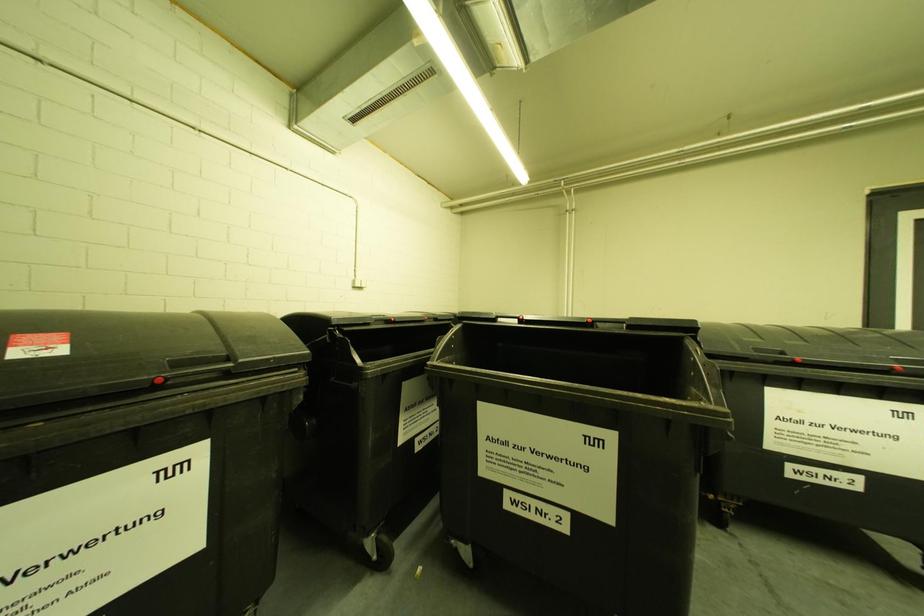
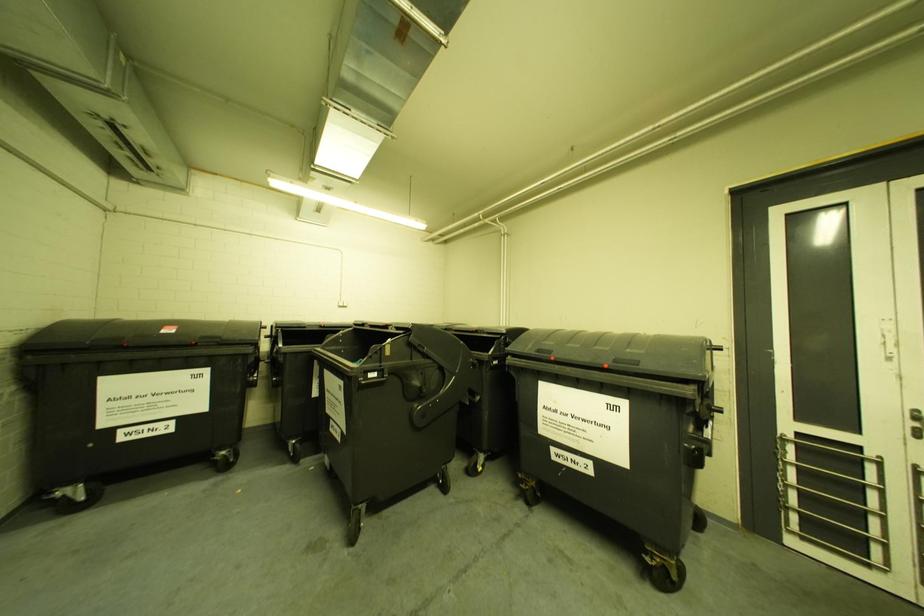
Question: In a continuous first-person perspective shot, in which direction is the camera moving?

Choices:
 (A) Left
 (B) Right
 (C) Forward
 (D) Backward

Answer: (B)